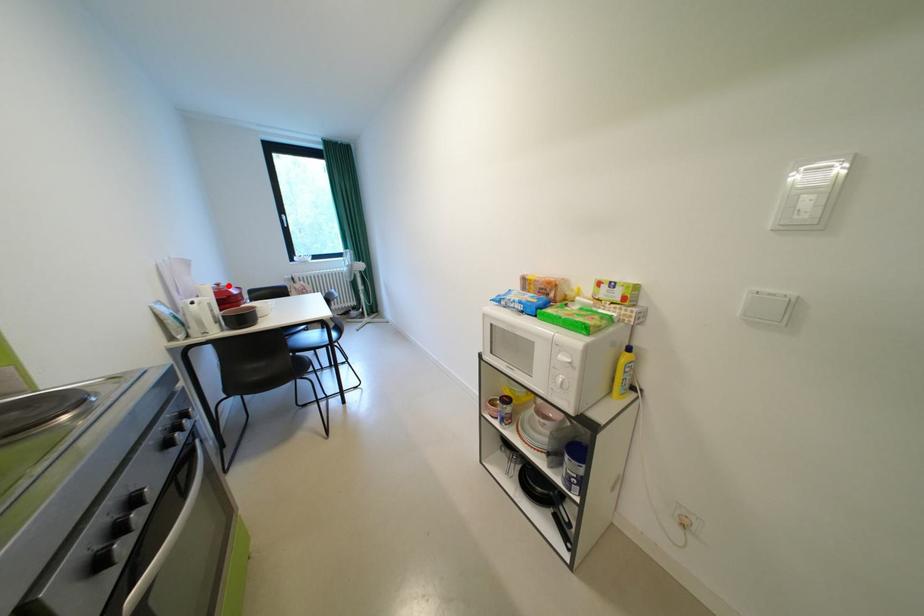
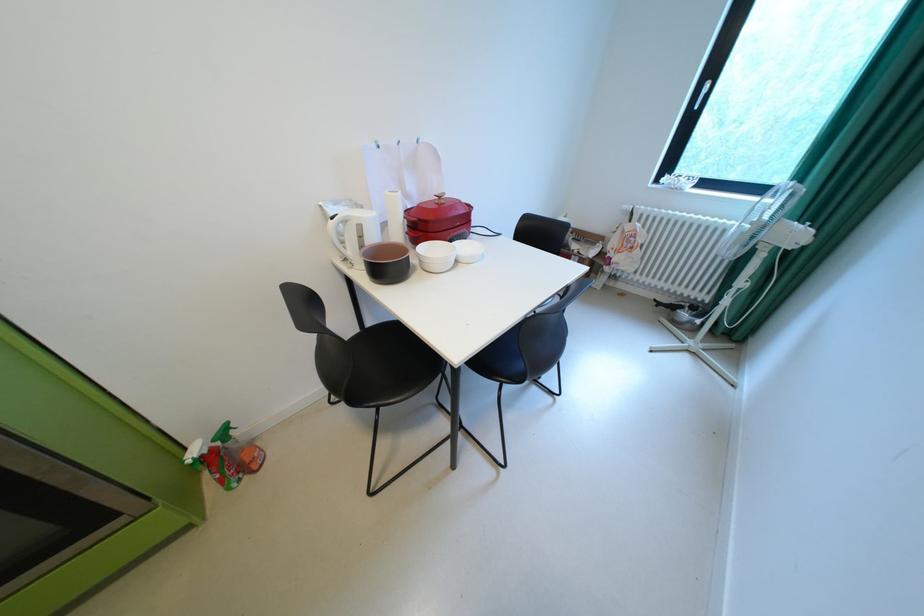
Where in the second image is the point corresponding to the highlighted location from the first image?

(450, 198)